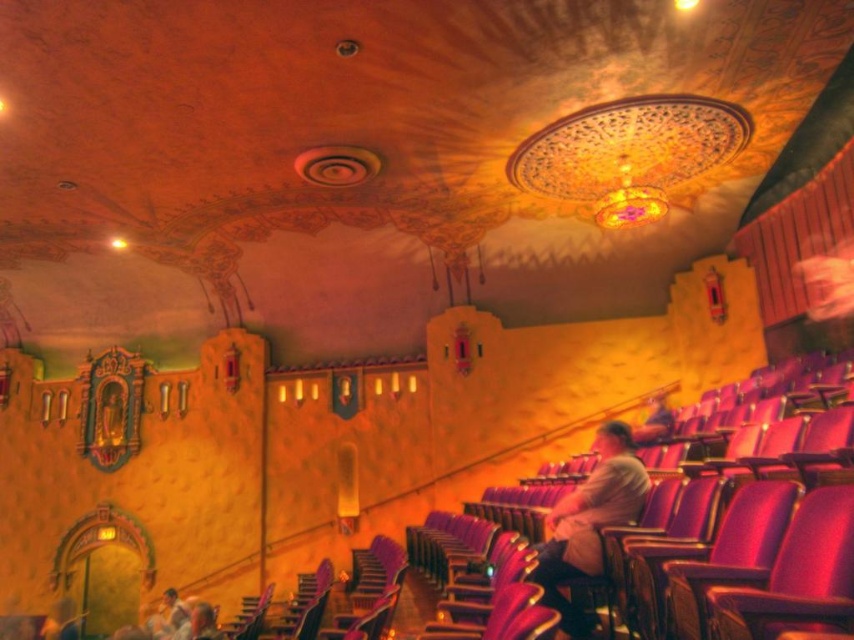
Is light brown leather jacket at center bigger than light brown leather jacket at lower left?

Yes, light brown leather jacket at center is bigger than light brown leather jacket at lower left.

Who is taller, light brown leather jacket at center or light brown leather jacket at lower left?

light brown leather jacket at center

Find the location of a particular element. The width and height of the screenshot is (854, 640). light brown leather jacket at center is located at coordinates (589, 522).

This screenshot has height=640, width=854. Identify the location of light brown leather jacket at center. (589, 522).

Does point (185, 632) come farther from viewer compared to point (215, 612)?

No, it is not.

Based on the photo, can you confirm if light brown leather jacket at lower left is shorter than matte gray hair at lower left?

Correct, light brown leather jacket at lower left is not as tall as matte gray hair at lower left.

The image size is (854, 640). What do you see at coordinates (168, 618) in the screenshot?
I see `light brown leather jacket at lower left` at bounding box center [168, 618].

The image size is (854, 640). Find the location of `light brown leather jacket at lower left`. light brown leather jacket at lower left is located at coordinates (168, 618).

Does light brown leather jacket at center appear over matte gray hair at lower left?

Correct, light brown leather jacket at center is located above matte gray hair at lower left.

Between point (598, 458) and point (225, 636), which one is positioned behind?

The point (598, 458) is more distant.

Does point (619, 468) come in front of point (205, 620)?

Yes, it is.

Identify the location of light brown leather jacket at center. [589, 522].